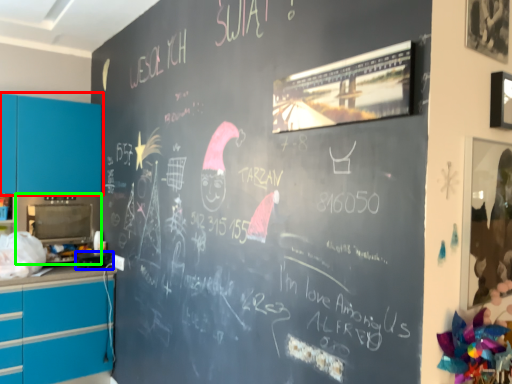
Question: Which is nearer to the cabinetry (highlighted by a red box)? appliance (highlighted by a blue box) or appliance (highlighted by a green box).

Choices:
 (A) appliance
 (B) appliance

Answer: (B)